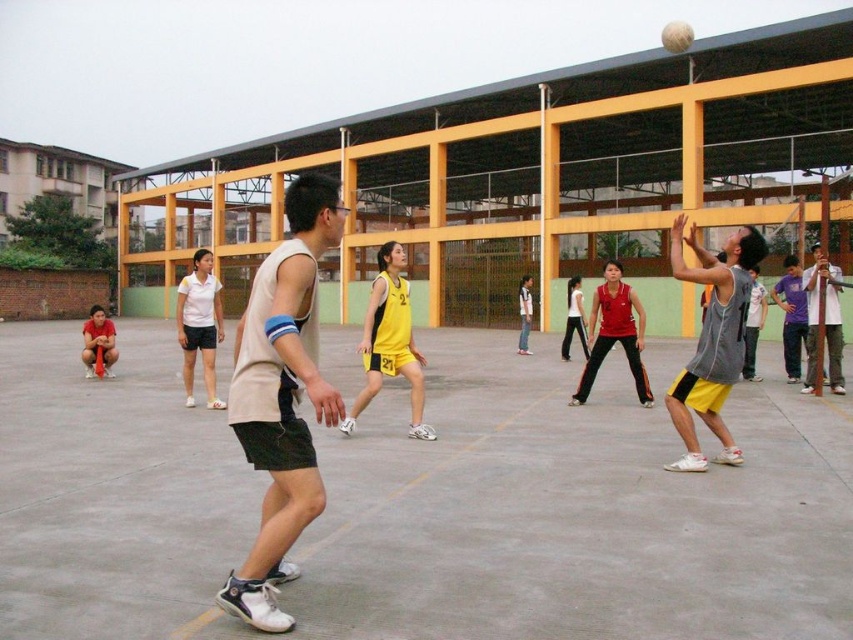
Question: Which of the following is the farthest from the observer?

Choices:
 (A) (836, 289)
 (B) (76, 529)

Answer: (A)

Question: Observing the image, what is the correct spatial positioning of light beige sleeveless shirt at center in reference to matte yellow jersey at center?

Choices:
 (A) left
 (B) right

Answer: (A)

Question: Which point is closer to the camera taking this photo?

Choices:
 (A) (584, 346)
 (B) (364, 538)

Answer: (B)

Question: Does gray sleeveless shirt at center appear on the right side of matte red shorts at lower left?

Choices:
 (A) no
 (B) yes

Answer: (B)

Question: Can you confirm if light beige sleeveless shirt at center is positioned to the left of white matte basketball at center?

Choices:
 (A) yes
 (B) no

Answer: (A)

Question: Considering the real-world distances, which object is closest to the light beige sleeveless shirt at center?

Choices:
 (A) gray fabric shirt at center
 (B) matte red shorts at lower left

Answer: (A)